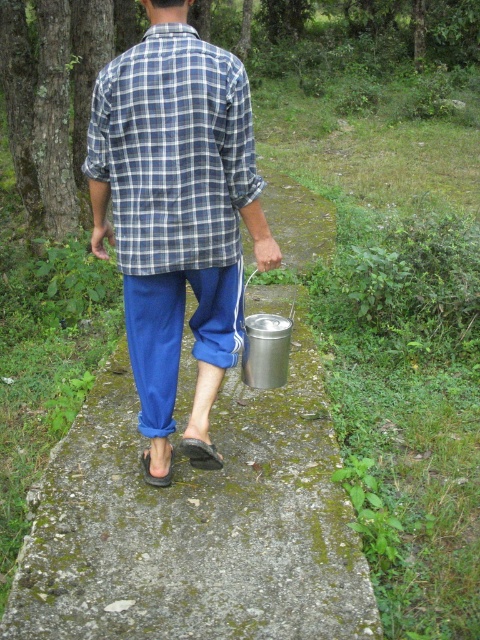
Question: Does mossy concrete pavement at center lie in front of blue plaid shirt at center?

Choices:
 (A) no
 (B) yes

Answer: (B)

Question: Is mossy concrete pavement at center positioned behind blue cotton pants at lower center?

Choices:
 (A) yes
 (B) no

Answer: (B)

Question: Which point is closer to the camera?

Choices:
 (A) (156, 49)
 (B) (216, 156)
 (C) (48, 497)

Answer: (A)

Question: Considering the relative positions of mossy concrete pavement at center and blue cotton pants at lower center in the image provided, where is mossy concrete pavement at center located with respect to blue cotton pants at lower center?

Choices:
 (A) left
 (B) right

Answer: (B)

Question: Which of the following is the closest to the observer?

Choices:
 (A) blue cotton pants at lower center
 (B) blue plaid shirt at center
 (C) mossy concrete pavement at center

Answer: (C)

Question: Among these points, which one is farthest from the camera?

Choices:
 (A) (206, 192)
 (B) (243, 161)

Answer: (B)